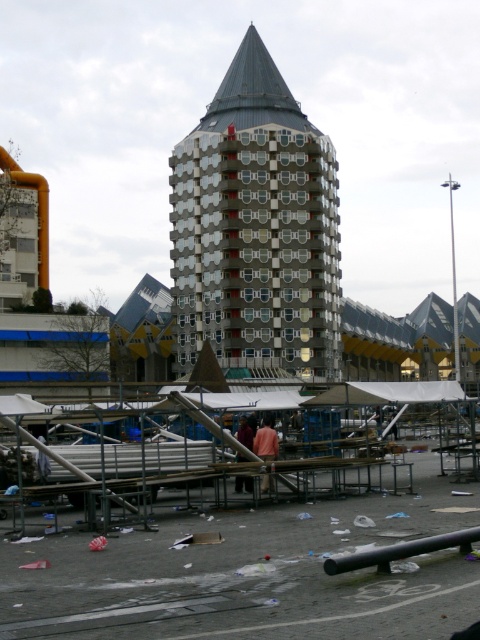
Is metal scaffolding at center bigger than metallic gray building at center?

No, metal scaffolding at center is not bigger than metallic gray building at center.

Which is in front, point (169, 572) or point (303, 205)?

Positioned in front is point (169, 572).

Identify the location of metal scaffolding at center. This screenshot has width=480, height=640. (250, 577).